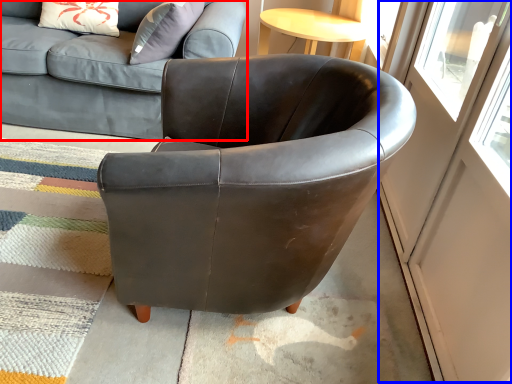
Question: Which of the following is the farthest to the observer, studio couch (highlighted by a red box) or screen door (highlighted by a blue box)?

Choices:
 (A) studio couch
 (B) screen door

Answer: (A)